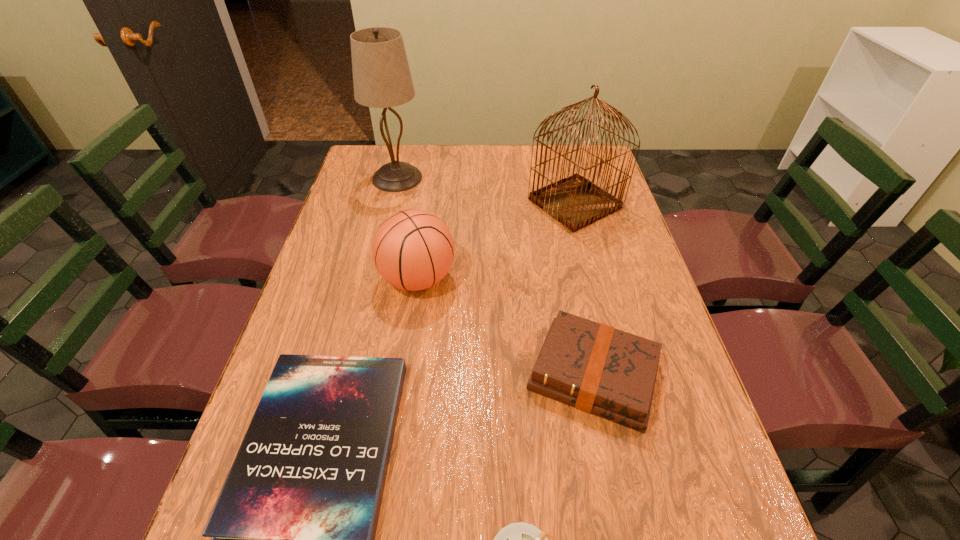
This screenshot has width=960, height=540. I want to click on lampshade situated at the far edge, so click(381, 75).

I want to click on birdcage at the far edge, so click(x=576, y=202).

Find the location of a particular element. Image resolution: width=960 pixels, height=540 pixels. object present at the left edge is located at coordinates (381, 75).

You are a GUI agent. You are given a task and a screenshot of the screen. Output one action in this format:
    pyautogui.click(x=<x>, y=<y>)
    Task: Click on the birdcage at the right edge
    Image resolution: width=960 pixels, height=540 pixels.
    Given the screenshot: What is the action you would take?
    pyautogui.click(x=576, y=202)

This screenshot has width=960, height=540. What are the coordinates of `hardback book situated at the right edge` in the screenshot? It's located at (598, 369).

Find the location of a particular element. The height and width of the screenshot is (540, 960). object that is at the far left corner is located at coordinates (381, 75).

You are a GUI agent. You are given a task and a screenshot of the screen. Output one action in this format:
    pyautogui.click(x=<x>, y=<y>)
    Task: Click on the object positioned at the far right corner
    The width and height of the screenshot is (960, 540).
    Given the screenshot: What is the action you would take?
    pyautogui.click(x=576, y=202)

This screenshot has height=540, width=960. I want to click on vacant space at the far edge of the desktop, so click(x=540, y=156).

At what (x,y) coordinates should I click in order to perform the action: click on free region at the left edge. Please return your answer as a coordinate pair (x, y). Looking at the image, I should click on (332, 272).

At what (x,y) coordinates should I click in order to perform the action: click on vacant region at the right edge of the desktop. Please return your answer as a coordinate pair (x, y). Looking at the image, I should click on pyautogui.click(x=701, y=409).